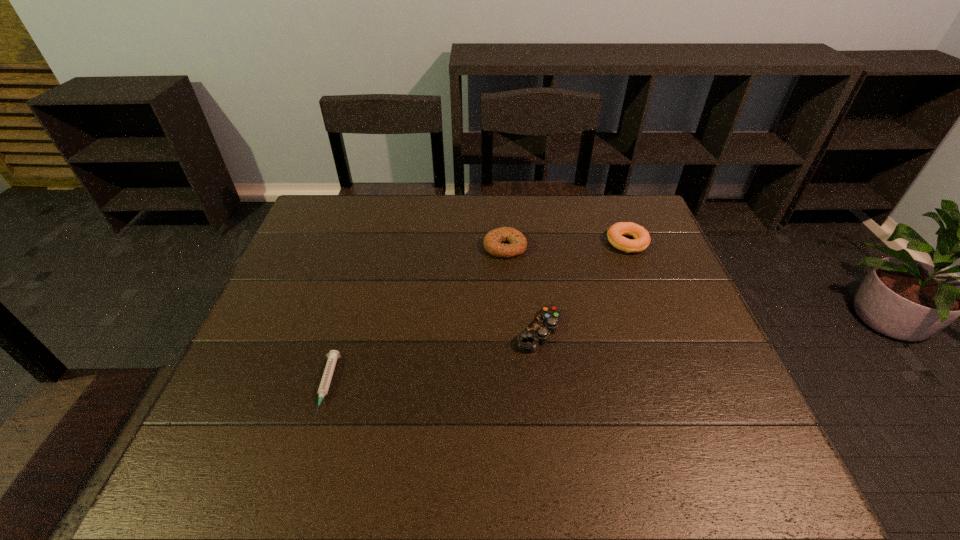
I want to click on the rightmost object, so click(x=615, y=233).

Locate an element on the screen. the left bagel is located at coordinates (494, 240).

At what (x,y) coordinates should I click in order to perform the action: click on the third farthest object. Please return your answer as a coordinate pair (x, y). The width and height of the screenshot is (960, 540). Looking at the image, I should click on (546, 323).

Find the location of `the third tallest object`. the third tallest object is located at coordinates (546, 323).

This screenshot has height=540, width=960. What are the coordinates of `the nearest object` in the screenshot? It's located at (333, 355).

Find the location of a particular element. This screenshot has width=960, height=540. the leftmost object is located at coordinates (333, 355).

This screenshot has height=540, width=960. In order to click on vacant space located 0.190m on the left of the right bagel in this screenshot , I will do `click(544, 243)`.

Identify the location of blank space located on the right of the left bagel. The image size is (960, 540). (596, 247).

Where is `free space located 0.170m on the back of the third tallest object`? Image resolution: width=960 pixels, height=540 pixels. free space located 0.170m on the back of the third tallest object is located at coordinates (531, 267).

You are a GUI agent. You are given a task and a screenshot of the screen. Output one action in this format:
    pyautogui.click(x=<x>, y=<y>)
    Task: Click on the blank space located at the needle end of the shortest object
    
    Given the screenshot: What is the action you would take?
    pyautogui.click(x=308, y=448)